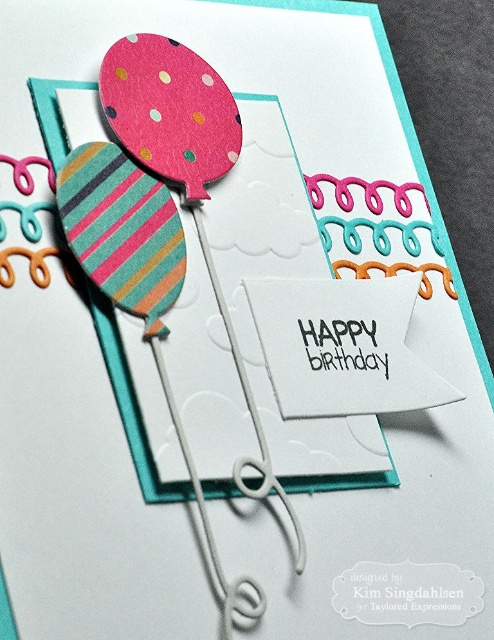
Between polka dot paper balloon at upper left and white wire at center, which one appears on the right side from the viewer's perspective?

Positioned to the right is white wire at center.

Does polka dot paper balloon at upper left have a smaller size compared to white wire at center?

Indeed, polka dot paper balloon at upper left has a smaller size compared to white wire at center.

What do you see at coordinates (170, 112) in the screenshot?
I see `polka dot paper balloon at upper left` at bounding box center [170, 112].

You are a GUI agent. You are given a task and a screenshot of the screen. Output one action in this format:
    pyautogui.click(x=<x>, y=<y>)
    Task: Click on the polka dot paper balloon at upper left
    
    Given the screenshot: What is the action you would take?
    pyautogui.click(x=170, y=112)

Looking at this image, does striped paper balloon at left lie behind white wire at center?

Yes, striped paper balloon at left is further from the viewer.

Is point (129, 253) behind point (215, 556)?

Yes, it is.

The height and width of the screenshot is (640, 494). Find the location of `striped paper balloon at left`. striped paper balloon at left is located at coordinates (123, 230).

Between point (179, 241) and point (139, 45), which one is positioned in front?

Point (179, 241)

Is striped paper balloon at left to the right of polka dot paper balloon at upper left from the viewer's perspective?

Incorrect, striped paper balloon at left is not on the right side of polka dot paper balloon at upper left.

Where is `striped paper balloon at left`? The height and width of the screenshot is (640, 494). striped paper balloon at left is located at coordinates (123, 230).